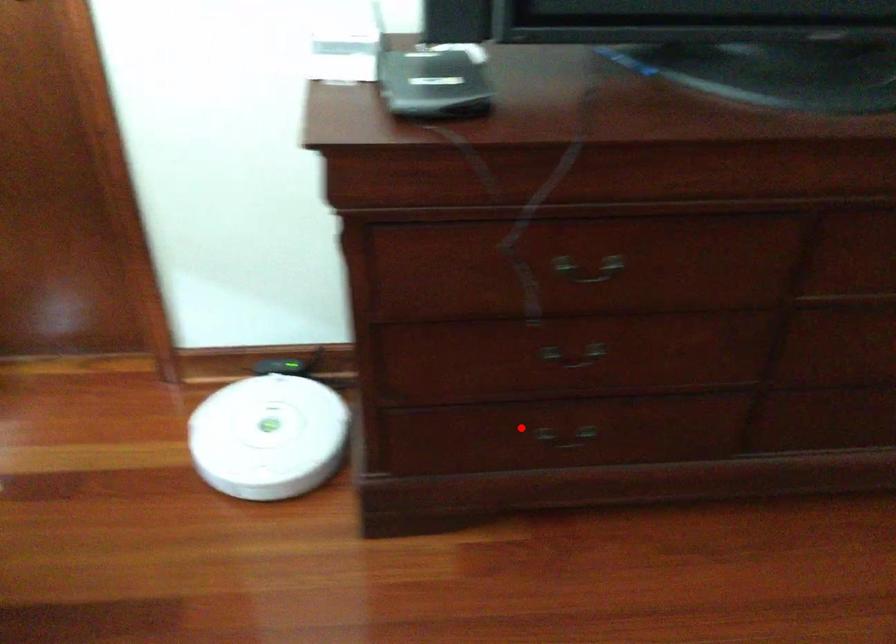
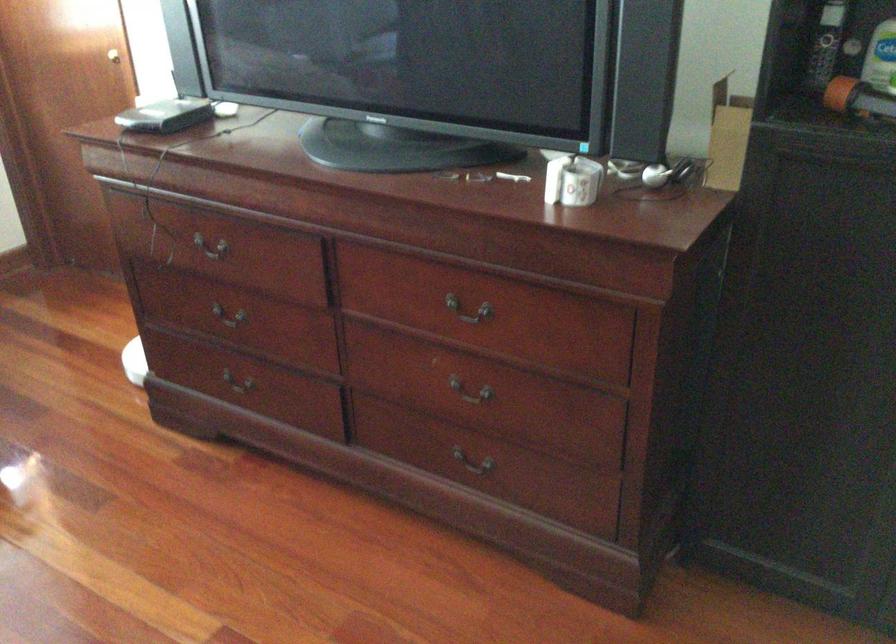
Question: I am providing you with two images of the same scene from different viewpoints. Image1 has a red point marked. In image2, the corresponding 3D location appears at what relative position? Reply with the corresponding letter.

Choices:
 (A) Closer
 (B) Farther

Answer: (B)